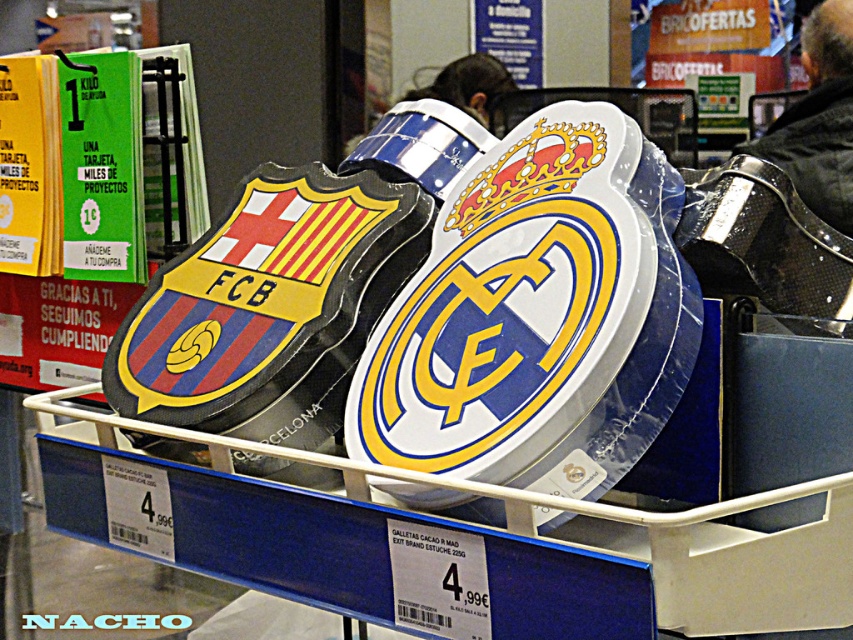
You are a customer in a sports store and see two football club signs displayed. The FC Barcelona sign is on the left, and the Real Madrid sign is on the right. There is a point marked at coordinates (x=532, y=308). Based on the store layout, which object is located at this point?

The point at coordinates (x=532, y=308) marks the white glossy shield at center.

You are a customer in a sports store and see the white glossy shield at center and the black leather jacket at upper right displayed on a shelf. Which item is placed higher up on the shelf?

The black leather jacket at upper right is placed higher up on the shelf than the white glossy shield at center.

Based on the photo, you are a customer at a sports merchandise store and want to buy both the white glossy shield at center and the black leather jacket at upper right. The store has a height restriction of 1.2 meters for items in the center display. Can both items be displayed together in the center without exceeding the height limit?

The white glossy shield at center is shorter than the black leather jacket at upper right. Since the height restriction is 1.2 meters for items in the center display, only the white glossy shield at center can be placed there. The black leather jacket at upper right exceeds the height limit and must be displayed elsewhere.